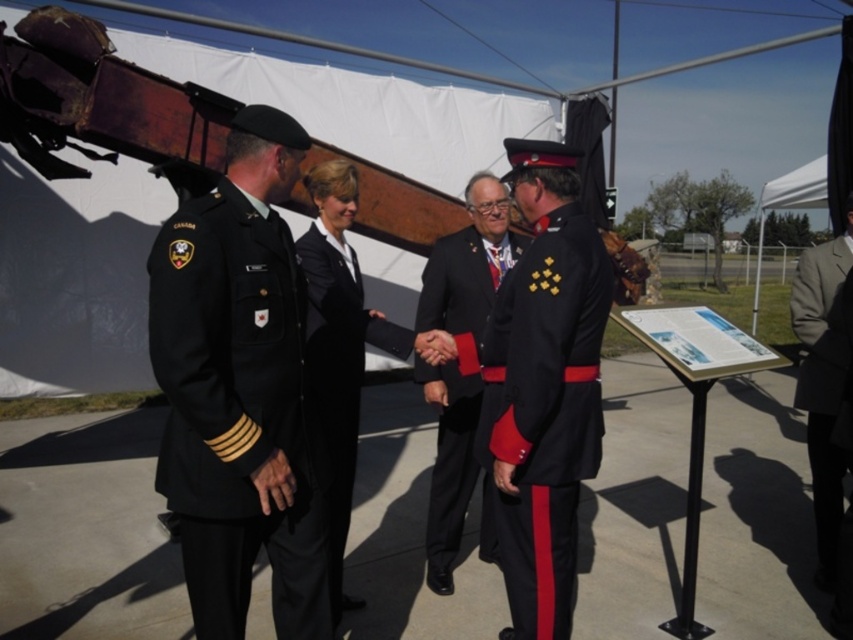
Question: Which point appears closest to the camera in this image?

Choices:
 (A) tap(547, 365)
 (B) tap(418, 378)

Answer: (A)

Question: Is the position of black wool military uniform at left less distant than that of light gray suit at right?

Choices:
 (A) yes
 (B) no

Answer: (A)

Question: Which point is closer to the camera?

Choices:
 (A) (570, 276)
 (B) (347, 449)
 (C) (200, 362)

Answer: (C)

Question: Can you confirm if black wool military uniform at left is smaller than black smooth suit at center?

Choices:
 (A) yes
 (B) no

Answer: (A)

Question: From the image, what is the correct spatial relationship of shiny black uniform at center in relation to light gray suit at right?

Choices:
 (A) below
 (B) above

Answer: (A)

Question: Which point is farther to the camera?

Choices:
 (A) shiny black uniform at center
 (B) light gray suit at right

Answer: (B)